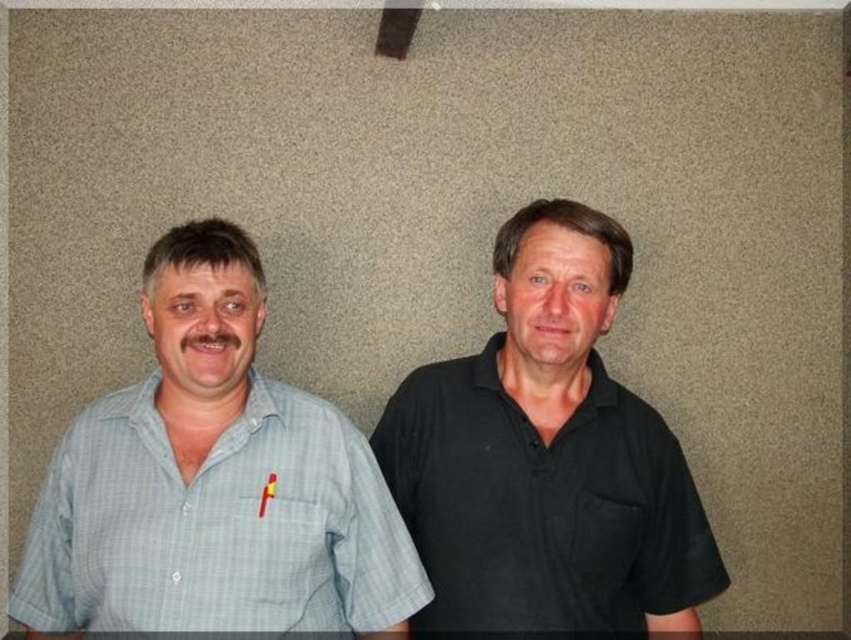
You are a photographer who needs to adjust the camera focus to capture both the black smooth shirt at right and the light blue checkered shirt at left clearly. Since the shirts are positioned differently, which shirt should you focus on first to ensure both are in focus?

The black smooth shirt at right is above the light blue checkered shirt at left. To ensure both are in focus, you should focus on the black smooth shirt at right first, as it is closer to the camera, and the depth of field will extend downward to include the light blue checkered shirt at left.

You are a photographer setting up for a group photo. You need to position yourself so that both the black smooth shirt at right and the light blue checkered shirt at left are in focus. Which person should you focus on first to ensure both are clear?

You should focus on the black smooth shirt at right first because it is closer to you than the light blue checkered shirt at left. By focusing on the closer subject, the farther one will also be in focus due to the depth of field.

You are a photographer setting up for a group photo. You need to ensure that the distance between the black smooth shirt at right and the light blue checkered shirt at left is at least 12 inches for proper framing. Based on the scene, is the current distance sufficient?

The black smooth shirt at right is 12.72 inches away from the light blue checkered shirt at left, which is more than the required 12 inches. Therefore, the current distance is sufficient for proper framing.